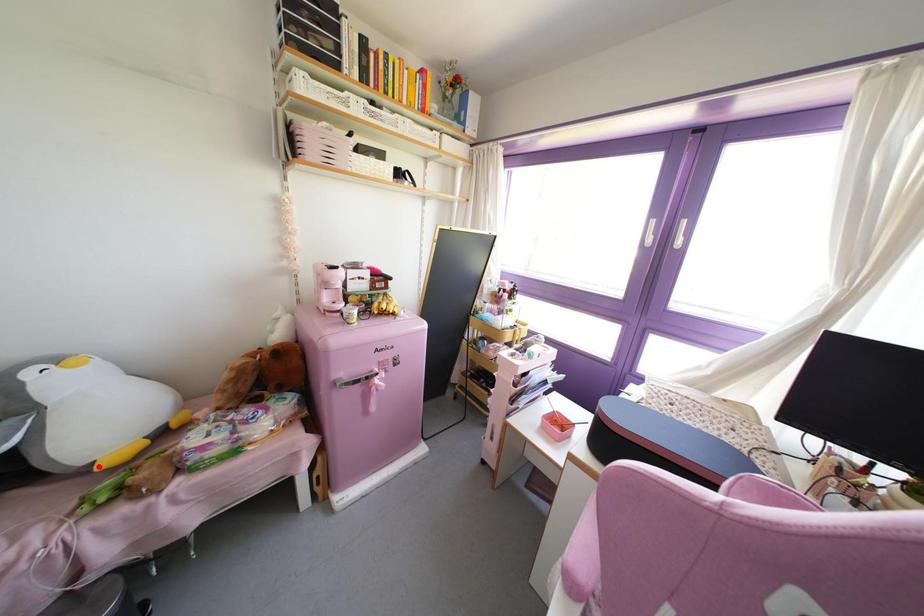
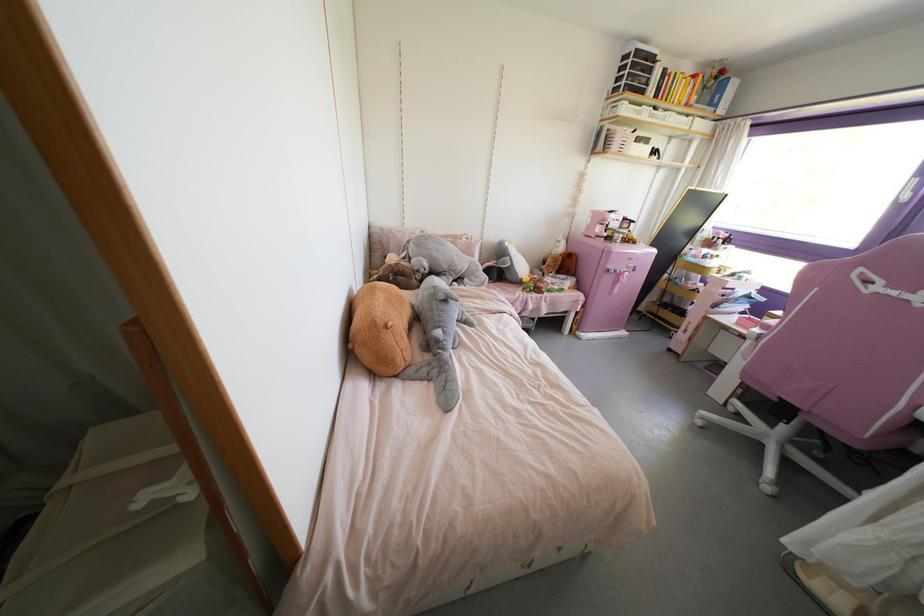
Locate, in the second image, the point that corresponds to the highlighted location in the first image.

(523, 280)